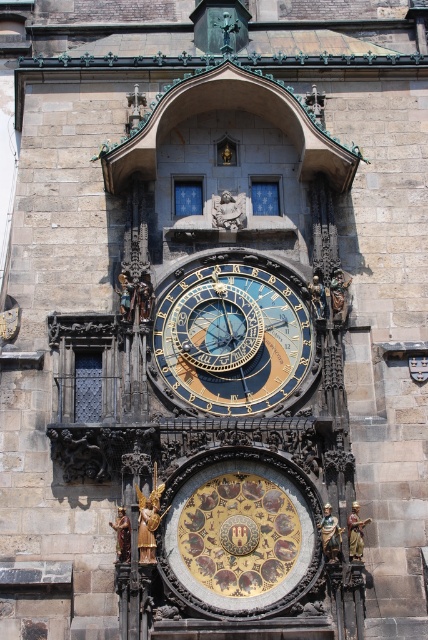
Between gold metallic clock at center and gold metallic statue at center-right, which one is positioned lower?

gold metallic clock at center is below.

Image resolution: width=428 pixels, height=640 pixels. Describe the element at coordinates (231, 339) in the screenshot. I see `gold metallic clock at center` at that location.

Does point (296, 307) come farther from viewer compared to point (330, 296)?

Yes, point (296, 307) is farther from viewer.

Identify the location of gold metallic clock at center. The image size is (428, 640). (231, 339).

What do you see at coordinates (228, 211) in the screenshot? I see `matte gold statue at center` at bounding box center [228, 211].

Which of these two, matte gold statue at center or gold metallic angel at lower left, stands taller?

gold metallic angel at lower left is taller.

Identify the location of matte gold statue at center. (228, 211).

In the scene shown: Which is below, gold metallic clock at center or gold polished statue at center?

gold polished statue at center is lower down.

Who is more forward, (306, 310) or (139, 525)?

Point (139, 525)

Which is behind, point (178, 317) or point (145, 502)?

Positioned behind is point (178, 317).

Identify the location of gold metallic clock at center. (231, 339).